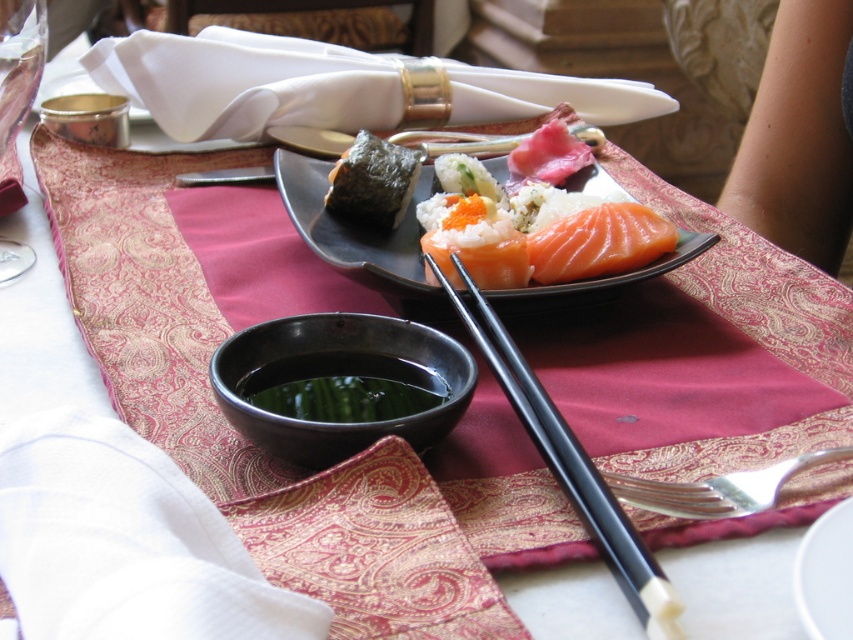
You are a guest at a sushi restaurant and want to place your chopsticks between the two points on the table. The first point is labeled as point [380,266] and the second point is labeled as point [646,488]. Based on the image, which point is closer to you, the guest?

Point [646,488] is closer to you since point [380,266] is behind it.

You are a sushi chef preparing to place a new sushi piece on the table. You have a seaweed wrapped sushi at center and a black glossy bowl at center. Which one has a greater width?

The black glossy bowl at center has a greater width than the seaweed wrapped sushi at center.